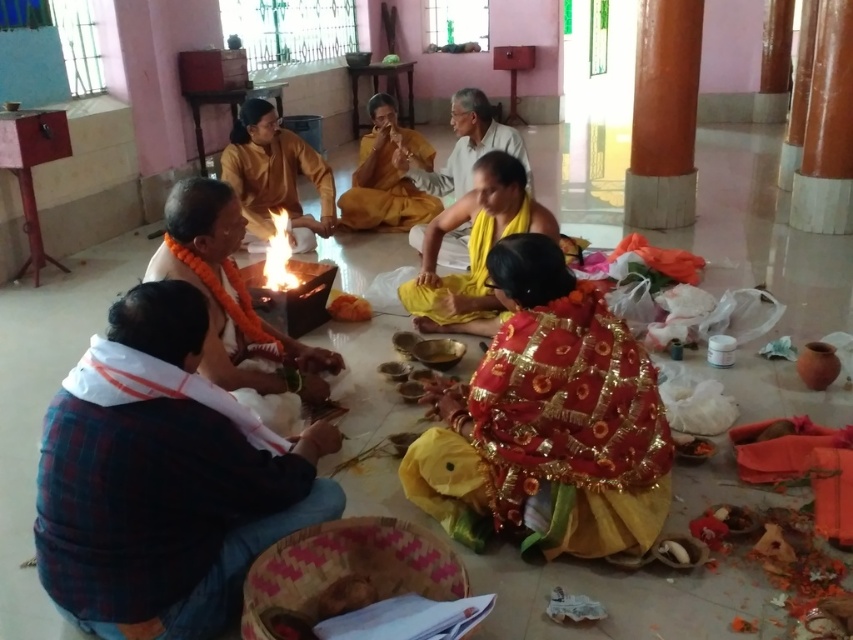
Between red sequined saree at center and matte black pot at center, which one appears on the left side from the viewer's perspective?

matte black pot at center

Does red sequined saree at center have a greater width compared to matte black pot at center?

Correct, the width of red sequined saree at center exceeds that of matte black pot at center.

Identify the location of red sequined saree at center. The image size is (853, 640). (547, 420).

I want to click on yellow silk saree at center, so click(474, 250).

Image resolution: width=853 pixels, height=640 pixels. Find the location of `yellow silk saree at center`. yellow silk saree at center is located at coordinates (474, 250).

Can you confirm if plaid fabric shirt at lower left is thinner than yellow silk saree at center?

Yes, plaid fabric shirt at lower left is thinner than yellow silk saree at center.

In the scene shown: Can you confirm if plaid fabric shirt at lower left is positioned below yellow silk saree at center?

Indeed, plaid fabric shirt at lower left is positioned under yellow silk saree at center.

Does point (283, 461) lie in front of point (521, 184)?

Yes.

Identify the location of plaid fabric shirt at lower left. (161, 496).